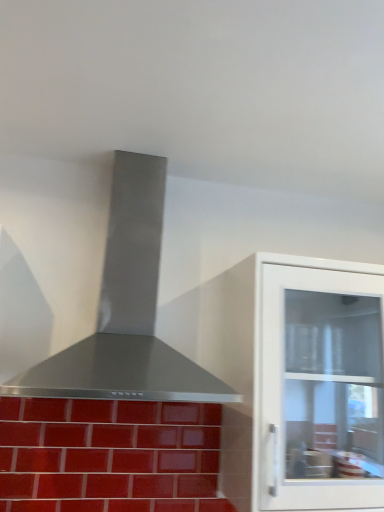
Question: Can you confirm if stainless steel vent at center is smaller than white glossy cabinet at right?

Choices:
 (A) yes
 (B) no

Answer: (B)

Question: Does stainless steel vent at center appear on the right side of white glossy cabinet at right?

Choices:
 (A) no
 (B) yes

Answer: (A)

Question: Is stainless steel vent at center to the left of white glossy cabinet at right from the viewer's perspective?

Choices:
 (A) no
 (B) yes

Answer: (B)

Question: Is there a large distance between stainless steel vent at center and white glossy cabinet at right?

Choices:
 (A) yes
 (B) no

Answer: (B)

Question: Is stainless steel vent at center positioned with its back to white glossy cabinet at right?

Choices:
 (A) no
 (B) yes

Answer: (A)

Question: Can you confirm if stainless steel vent at center is taller than white glossy cabinet at right?

Choices:
 (A) no
 (B) yes

Answer: (A)

Question: Would you say glossy ceramic tiles at lower left contains white glossy cabinet at right?

Choices:
 (A) no
 (B) yes

Answer: (A)

Question: Are glossy ceramic tiles at lower left and white glossy cabinet at right beside each other?

Choices:
 (A) yes
 (B) no

Answer: (B)

Question: Would you say glossy ceramic tiles at lower left is outside white glossy cabinet at right?

Choices:
 (A) yes
 (B) no

Answer: (A)

Question: Does glossy ceramic tiles at lower left appear on the left side of white glossy cabinet at right?

Choices:
 (A) no
 (B) yes

Answer: (B)

Question: Is the position of glossy ceramic tiles at lower left less distant than that of white glossy cabinet at right?

Choices:
 (A) yes
 (B) no

Answer: (B)

Question: Would you say glossy ceramic tiles at lower left is a long distance from white glossy cabinet at right?

Choices:
 (A) yes
 (B) no

Answer: (B)

Question: Is glossy ceramic tiles at lower left behind stainless steel vent at center?

Choices:
 (A) yes
 (B) no

Answer: (A)